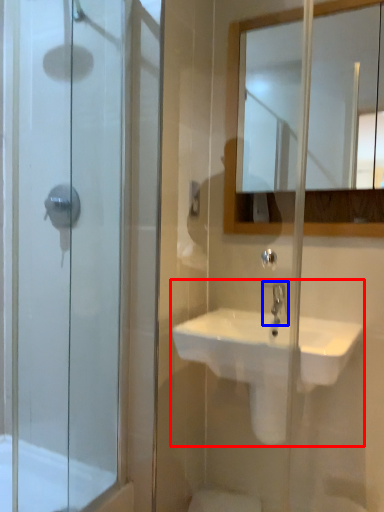
Question: Among these objects, which one is farthest to the camera, sink (highlighted by a red box) or tap (highlighted by a blue box)?

Choices:
 (A) sink
 (B) tap

Answer: (B)